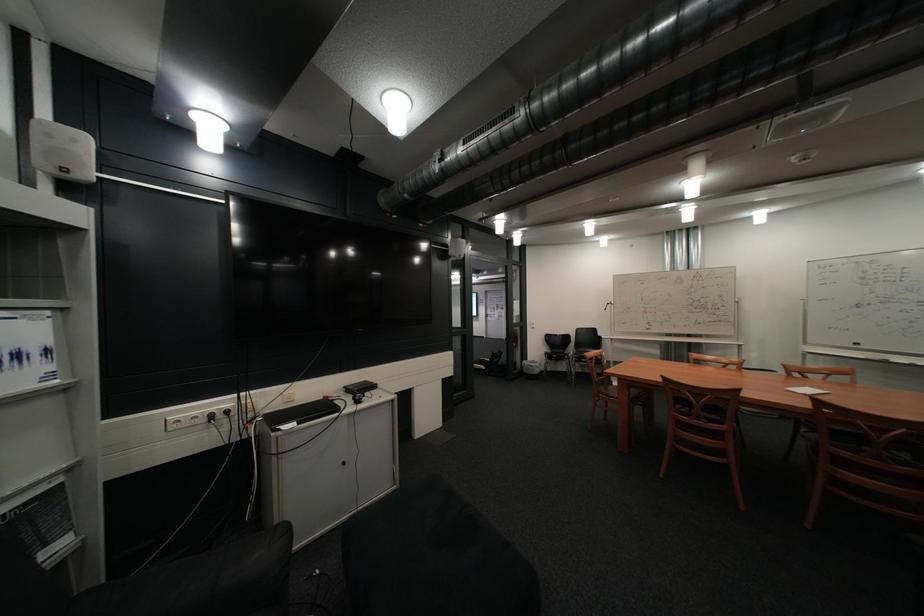
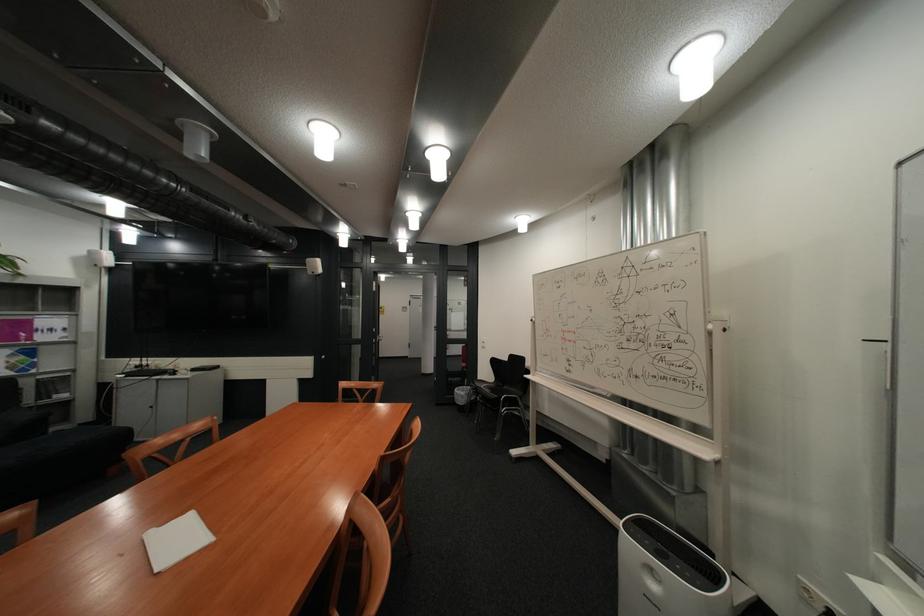
Find the pixel in the second image that matches pixel 752 301 in the first image.

(725, 326)